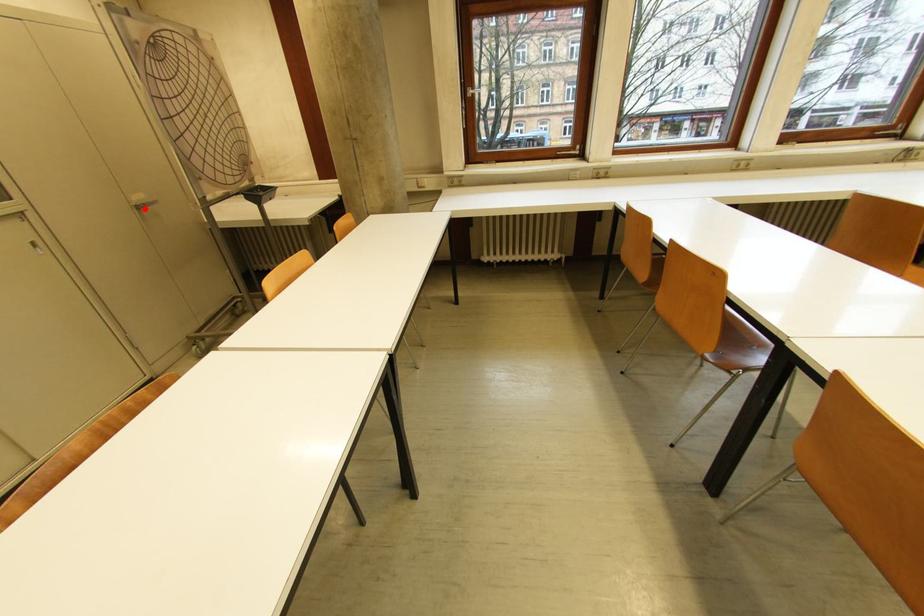
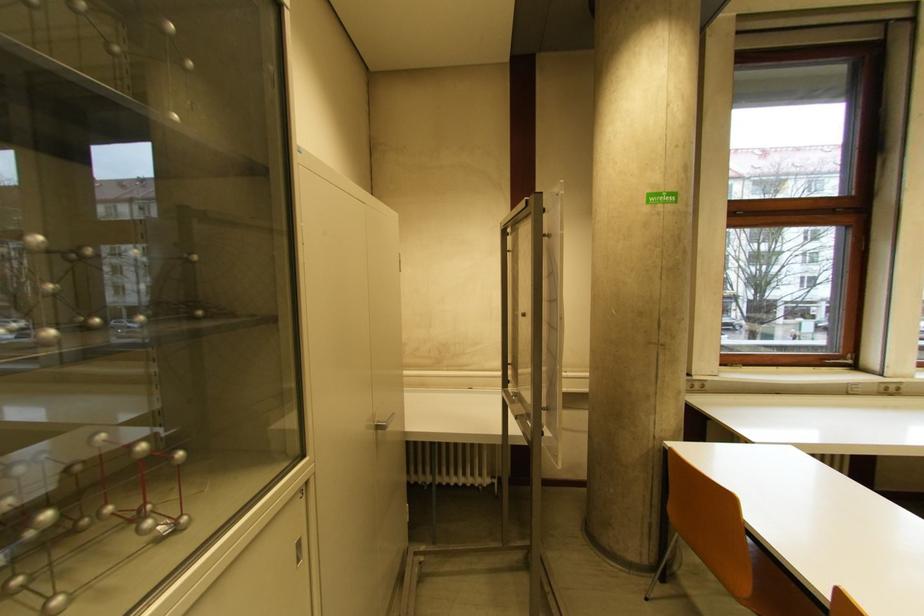
Find the pixel in the second image that matches the highlighted location in the first image.

(385, 429)